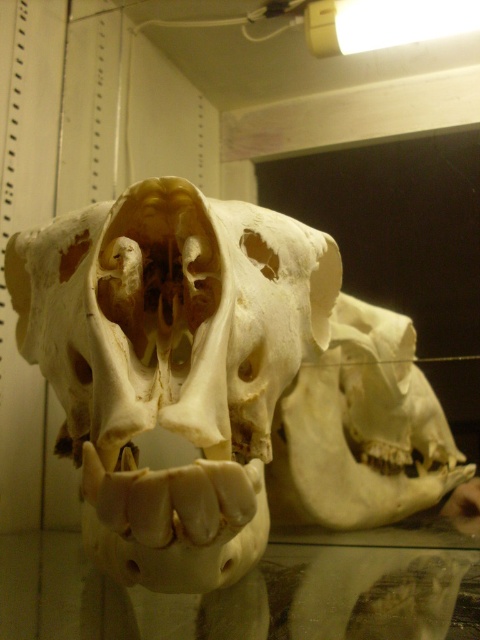
Question: Estimate the real-world distances between objects in this image. Which object is farther from the white bone skull at center?

Choices:
 (A) white matte skull at center
 (B) transparent glass table at lower center

Answer: (A)

Question: Does white bone skull at center appear under white matte skull at center?

Choices:
 (A) no
 (B) yes

Answer: (A)

Question: Can you confirm if white bone skull at center is bigger than white matte skull at center?

Choices:
 (A) yes
 (B) no

Answer: (A)

Question: Which object appears closest to the camera in this image?

Choices:
 (A) white matte skull at center
 (B) white bone skull at center
 (C) transparent glass table at lower center

Answer: (B)

Question: Among these points, which one is farthest from the camera?

Choices:
 (A) (292, 472)
 (B) (231, 296)
 (C) (212, 611)

Answer: (A)

Question: Where is white bone skull at center located in relation to white matte skull at center in the image?

Choices:
 (A) below
 (B) above

Answer: (B)